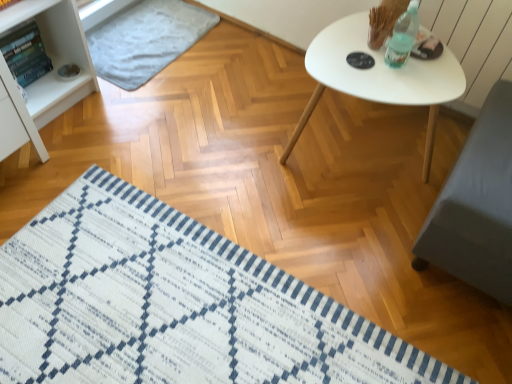
You are a GUI agent. You are given a task and a screenshot of the screen. Output one action in this format:
    pyautogui.click(x=<x>, y=<y>)
    Task: Click on the vacant space in light gray textured mat at upper left, acting as the first mat starting from the back (from a real-world perspective)
    Image resolution: width=512 pixels, height=384 pixels.
    Given the screenshot: What is the action you would take?
    pyautogui.click(x=147, y=44)